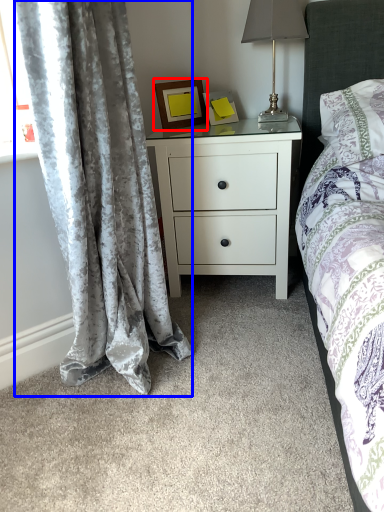
Question: Which object is closer to the camera taking this photo, picture frame (highlighted by a red box) or curtain (highlighted by a blue box)?

Choices:
 (A) picture frame
 (B) curtain

Answer: (B)